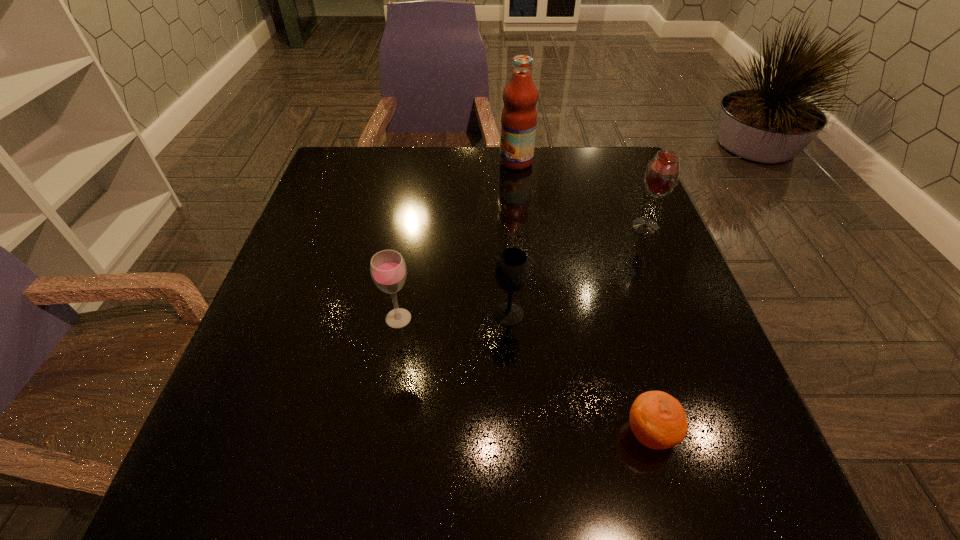
Where is `free location that satisfies the following two spatial constraints: 1. on the front label of the fruit juice; 2. on the front side of the leftmost wineglass`? free location that satisfies the following two spatial constraints: 1. on the front label of the fruit juice; 2. on the front side of the leftmost wineglass is located at coordinates (533, 318).

The height and width of the screenshot is (540, 960). Identify the location of vacant area in the image that satisfies the following two spatial constraints: 1. on the front label of the shortest object; 2. on the right side of the tallest object. (545, 434).

I want to click on blank space that satisfies the following two spatial constraints: 1. on the back side of the second wineglass from left to right; 2. on the right side of the leftmost wineglass, so click(x=399, y=314).

Find the location of a particular element. vacant region that satisfies the following two spatial constraints: 1. on the back side of the rightmost object; 2. on the front label of the fruit juice is located at coordinates (618, 161).

This screenshot has height=540, width=960. Find the location of `free space that satisfies the following two spatial constraints: 1. on the front side of the shortest object; 2. on the right side of the leftmost wineglass`. free space that satisfies the following two spatial constraints: 1. on the front side of the shortest object; 2. on the right side of the leftmost wineglass is located at coordinates (379, 434).

Find the location of `free space that satisfies the following two spatial constraints: 1. on the front label of the farthest object; 2. on the back side of the second object from right to left`. free space that satisfies the following two spatial constraints: 1. on the front label of the farthest object; 2. on the back side of the second object from right to left is located at coordinates (545, 434).